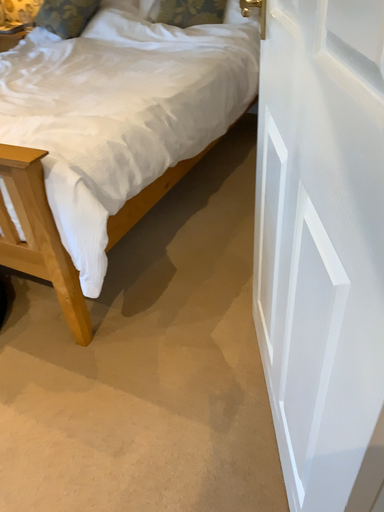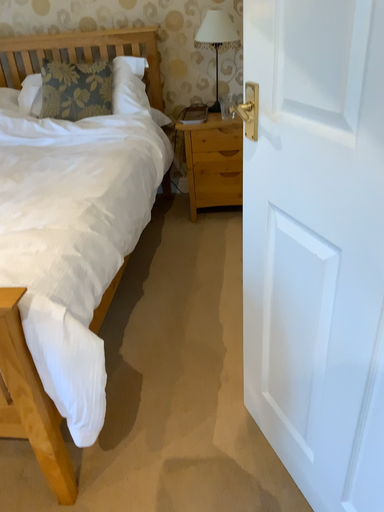
Question: Which way did the camera rotate in the video?

Choices:
 (A) rotated downward
 (B) rotated upward

Answer: (B)